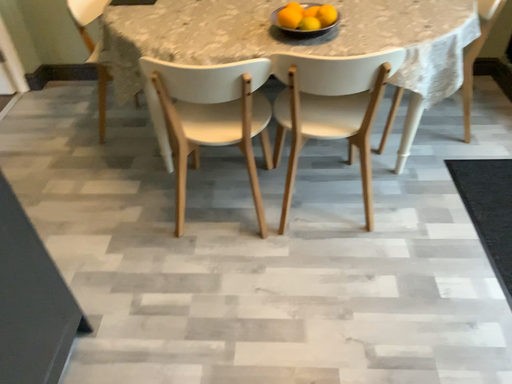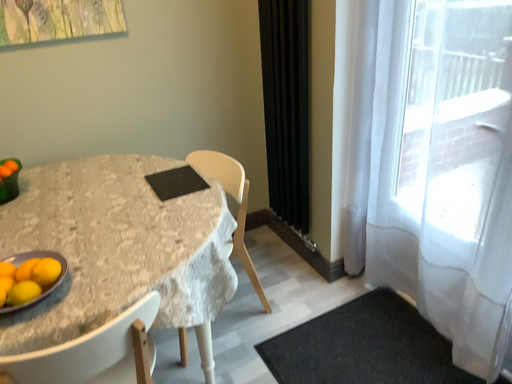
Question: Which way did the camera rotate in the video?

Choices:
 (A) rotated upward
 (B) rotated downward

Answer: (A)